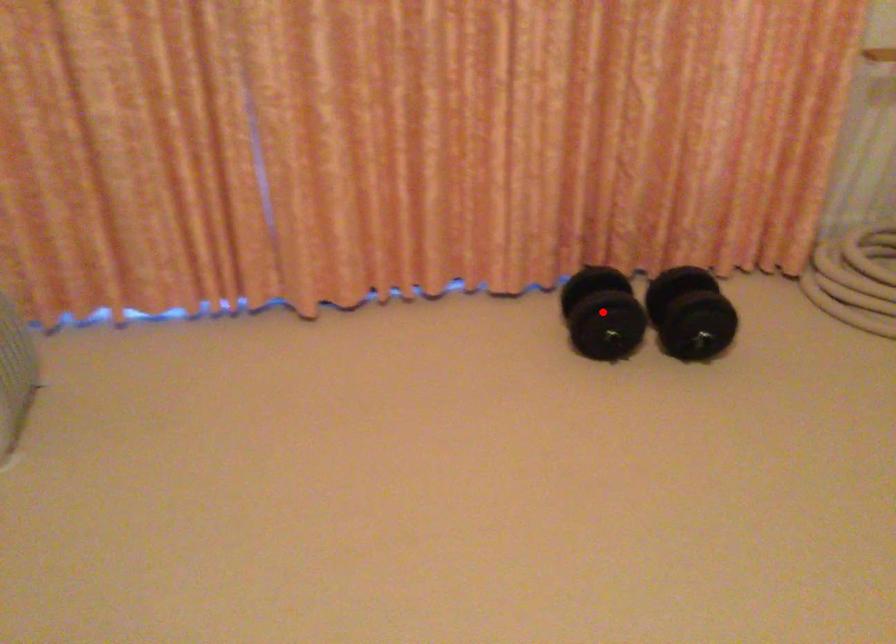
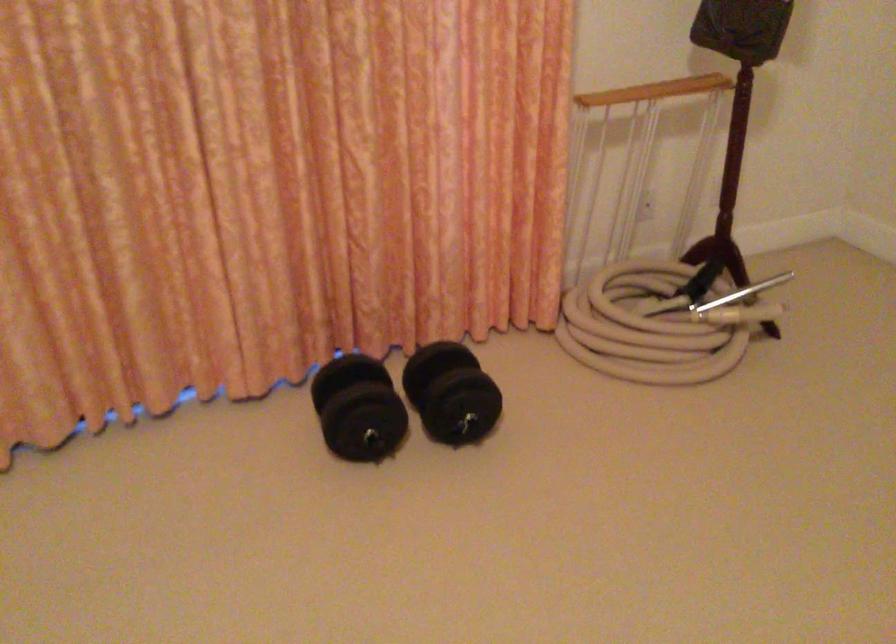
The point at the highlighted location is marked in the first image. Where is the corresponding point in the second image?

(358, 408)